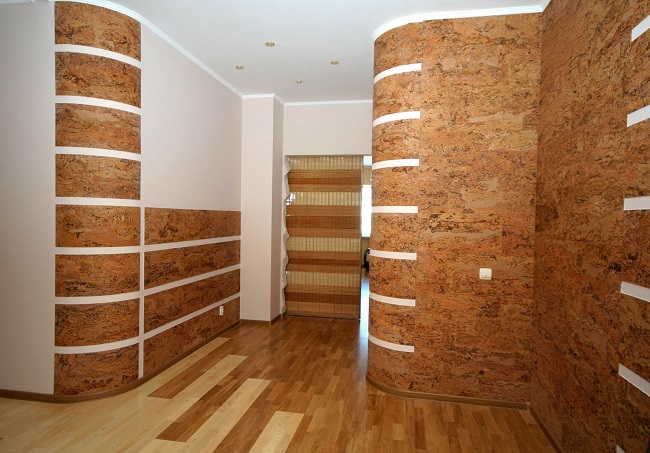
Image resolution: width=650 pixels, height=453 pixels. In order to click on left of floor in this screenshot , I will do `click(36, 203)`.